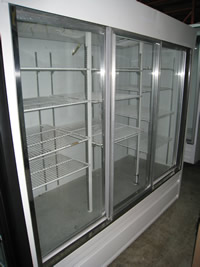
Find the location of `metal floor of fridge`. metal floor of fridge is located at coordinates (67, 215).